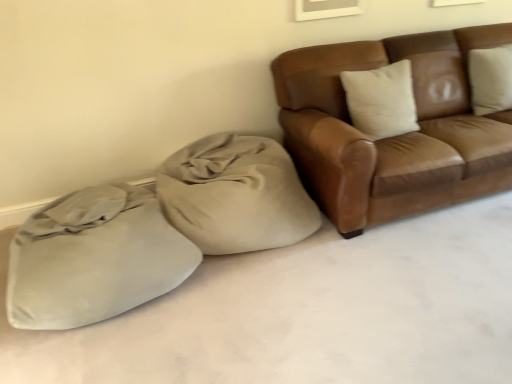
Question: Is suede-like beige sack at lower left positioned with its back to beige fabric bean bag at center?

Choices:
 (A) no
 (B) yes

Answer: (A)

Question: Is suede-like beige sack at lower left taller than beige fabric bean bag at center?

Choices:
 (A) yes
 (B) no

Answer: (B)

Question: From a real-world perspective, is suede-like beige sack at lower left positioned over beige fabric bean bag at center based on gravity?

Choices:
 (A) no
 (B) yes

Answer: (A)

Question: Is the position of suede-like beige sack at lower left less distant than that of beige fabric bean bag at center?

Choices:
 (A) no
 (B) yes

Answer: (B)

Question: Is suede-like beige sack at lower left bigger than beige fabric bean bag at center?

Choices:
 (A) yes
 (B) no

Answer: (A)

Question: Is suede-like beige sack at lower left taller or shorter than beige fabric bean bag at center?

Choices:
 (A) short
 (B) tall

Answer: (A)

Question: From the image's perspective, relative to beige fabric bean bag at center, is suede-like beige sack at lower left above or below?

Choices:
 (A) above
 (B) below

Answer: (B)

Question: Do you think suede-like beige sack at lower left is within beige fabric bean bag at center, or outside of it?

Choices:
 (A) inside
 (B) outside

Answer: (B)

Question: Considering their positions, is suede-like beige sack at lower left located in front of or behind beige fabric bean bag at center?

Choices:
 (A) behind
 (B) front

Answer: (B)

Question: In the image, is brown leather couch at upper right on the left side or the right side of suede-like beige sack at lower left?

Choices:
 (A) right
 (B) left

Answer: (A)

Question: From a real-world perspective, is brown leather couch at upper right positioned above or below suede-like beige sack at lower left?

Choices:
 (A) above
 (B) below

Answer: (A)

Question: From the image's perspective, is brown leather couch at upper right located above or below suede-like beige sack at lower left?

Choices:
 (A) above
 (B) below

Answer: (A)

Question: Relative to suede-like beige sack at lower left, is brown leather couch at upper right in front or behind?

Choices:
 (A) front
 (B) behind

Answer: (B)

Question: From the image's perspective, is beige fabric bean bag at center above or below brown leather couch at upper right?

Choices:
 (A) above
 (B) below

Answer: (B)

Question: Do you think beige fabric bean bag at center is within brown leather couch at upper right, or outside of it?

Choices:
 (A) outside
 (B) inside

Answer: (A)